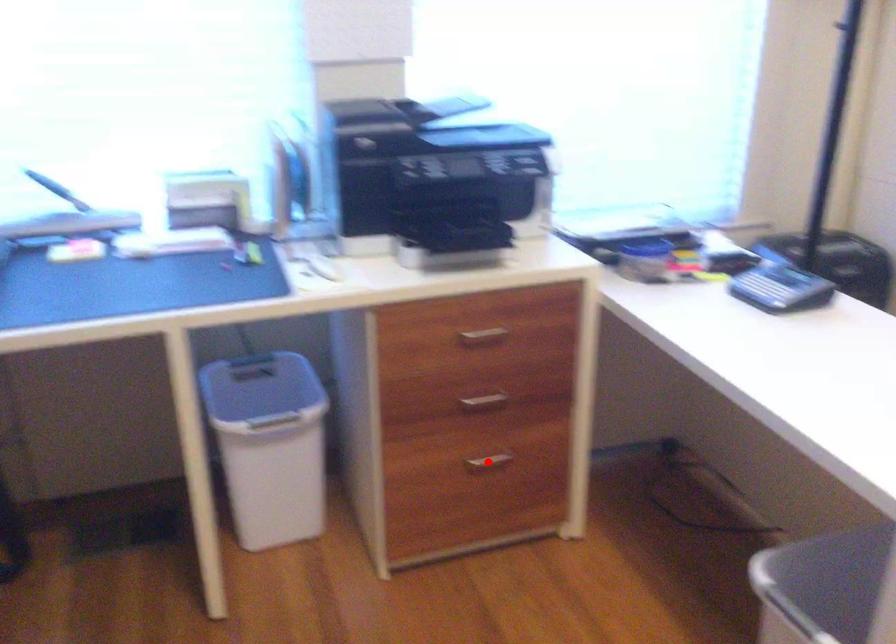
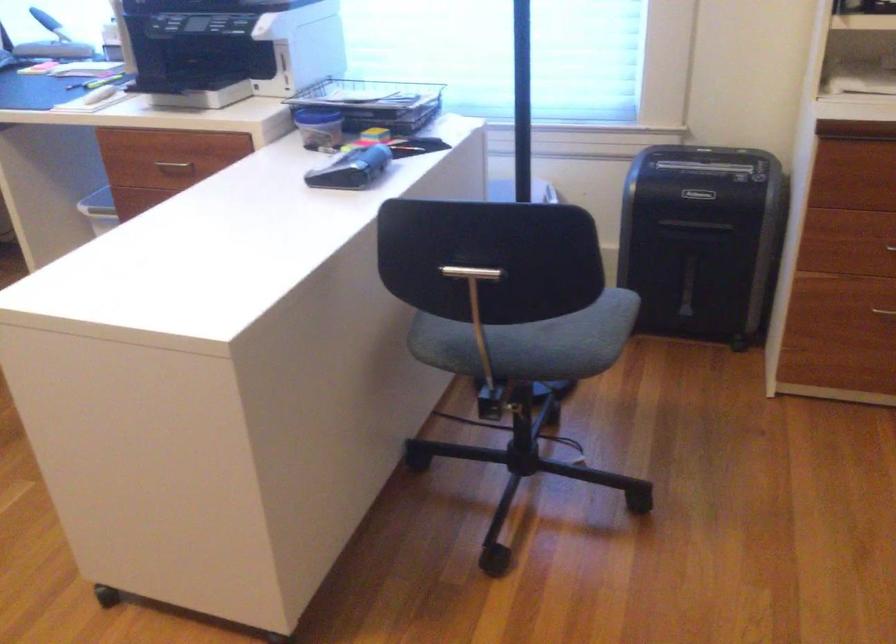
Question: I am providing you with two images of the same scene from different viewpoints. A red point is marked on the first image. Can you still see the location of the red point in image 2?

Choices:
 (A) Yes
 (B) No

Answer: (B)